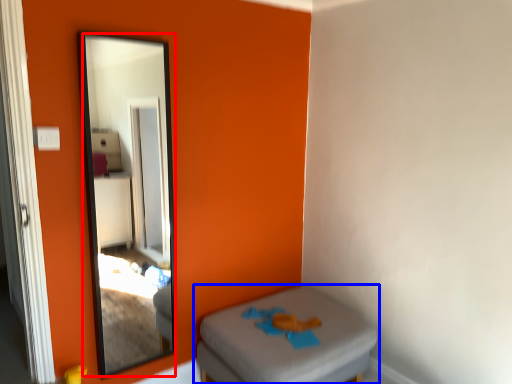
Question: Which point is closer to the camera, mirror (highlighted by a red box) or furniture (highlighted by a blue box)?

Choices:
 (A) mirror
 (B) furniture

Answer: (A)